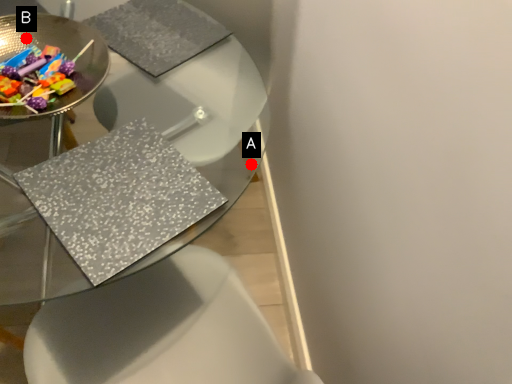
Question: Two points are circled on the image, labeled by A and B beside each circle. Which point is farther from the camera taking this photo?

Choices:
 (A) A is further
 (B) B is further

Answer: (A)